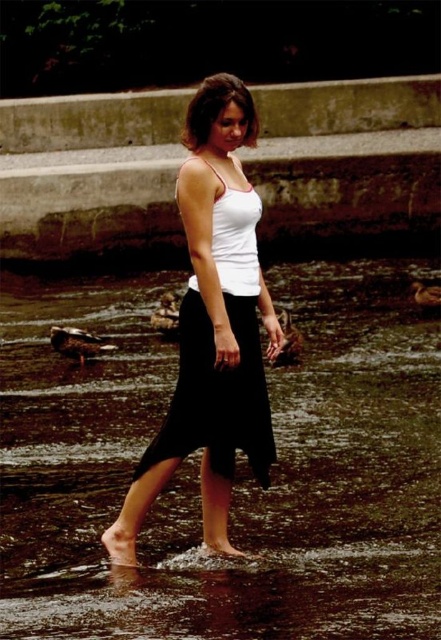
Looking at this image, you are standing at the point with coordinates point (x=197, y=177) and want to walk to the point with coordinates point (x=392, y=577). According to the scene, which direction should you move in?

You should move forward because point (x=392, y=577) is in front of point (x=197, y=177).

You are a photographer positioned in front of the scene. You want to capture a photo where the clear water at center is in focus while keeping the white matte tank top at center somewhat visible but not too sharp. Is this possible given their positions?

Yes, since the clear water at center is closer to the viewer than the white matte tank top at center, adjusting the camera focus on the water will keep the tank top slightly blurred but still visible in the background.